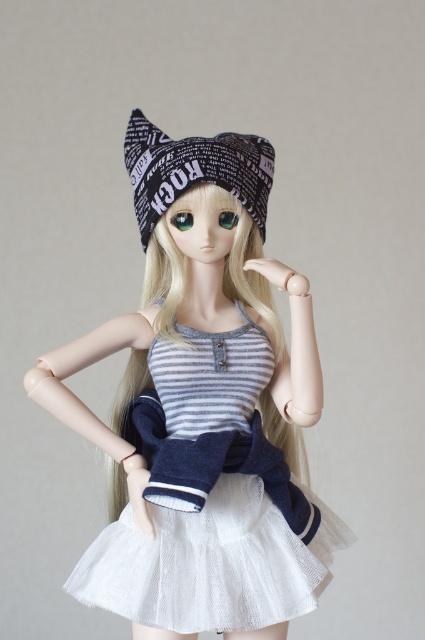
Based on the description, which object has a larger size between the white tulle skirt at center and the black printed beanie at center?

The white tulle skirt at center is bigger than the black printed beanie at center according to the description.

You are a fashion designer who wants to place a necklace between the white tulle skirt at center and the black printed beanie at center. The necklace requires 6 inches of space to fit. Is there enough space between them?

The white tulle skirt at center is 7.20 inches away from the black printed beanie at center. Since the necklace requires 6 inches of space, there is enough space between them to place the necklace.